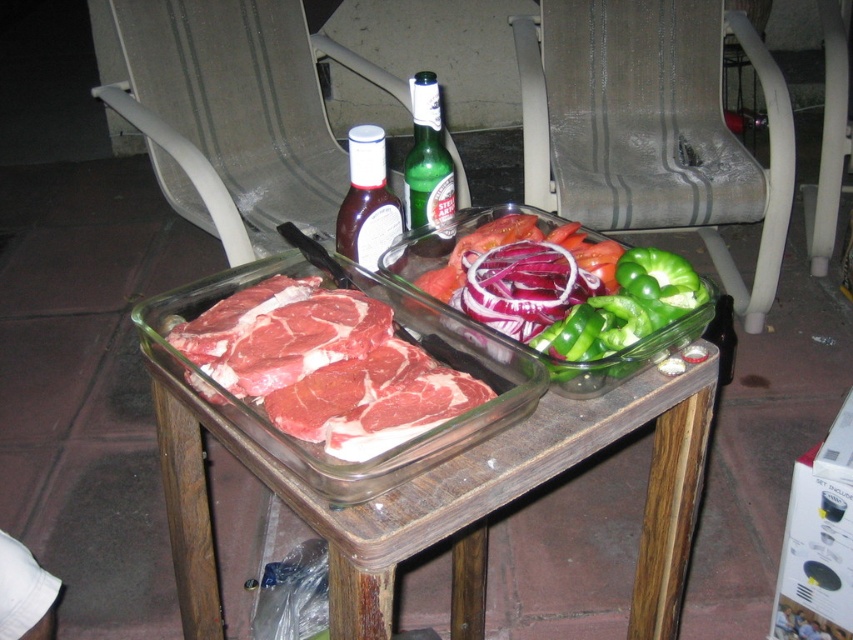
Question: Is raw red meat at center closer to camera compared to green glass bottle at center?

Choices:
 (A) yes
 (B) no

Answer: (A)

Question: Can you confirm if gray fabric chair at center is positioned to the left of white plastic chair at upper center?

Choices:
 (A) yes
 (B) no

Answer: (B)

Question: Estimate the real-world distances between objects in this image. Which object is closer to the purple translucent onion at center?

Choices:
 (A) raw red meat at center
 (B) transparent glass tray at center
 (C) white plastic chair at upper center

Answer: (A)

Question: Can you confirm if gray fabric chair at center is positioned above green glass bottle at center?

Choices:
 (A) no
 (B) yes

Answer: (B)

Question: Which object is the closest to the gray fabric chair at center?

Choices:
 (A) green glossy bell pepper at center
 (B) purple translucent onion at center

Answer: (A)

Question: Which point is closer to the camera?

Choices:
 (A) (271, 477)
 (B) (477, 307)
 (C) (602, 380)

Answer: (A)